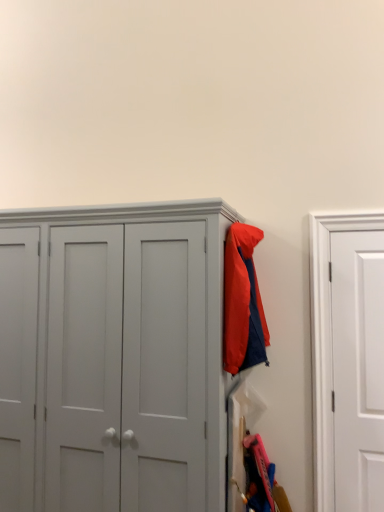
Question: Can you confirm if matte nylon jacket at upper right is taller than white matte door at right?

Choices:
 (A) no
 (B) yes

Answer: (A)

Question: Is matte nylon jacket at upper right oriented towards white matte door at right?

Choices:
 (A) yes
 (B) no

Answer: (B)

Question: Is matte nylon jacket at upper right positioned beyond the bounds of white matte door at right?

Choices:
 (A) no
 (B) yes

Answer: (B)

Question: Is matte nylon jacket at upper right wider than white matte door at right?

Choices:
 (A) no
 (B) yes

Answer: (B)

Question: Is matte nylon jacket at upper right beside white matte door at right?

Choices:
 (A) yes
 (B) no

Answer: (B)

Question: Choose the correct answer: Is matte nylon jacket at upper right inside matte gray cupboard at center or outside it?

Choices:
 (A) outside
 (B) inside

Answer: (A)

Question: Considering the positions of matte nylon jacket at upper right and matte gray cupboard at center in the image, is matte nylon jacket at upper right taller or shorter than matte gray cupboard at center?

Choices:
 (A) tall
 (B) short

Answer: (B)

Question: Based on their positions, is matte nylon jacket at upper right located to the left or right of matte gray cupboard at center?

Choices:
 (A) left
 (B) right

Answer: (B)

Question: Considering their positions, is matte nylon jacket at upper right located in front of or behind matte gray cupboard at center?

Choices:
 (A) behind
 (B) front

Answer: (A)

Question: From a real-world perspective, is white matte door at right positioned above or below matte nylon jacket at upper right?

Choices:
 (A) below
 (B) above

Answer: (A)

Question: In the image, is white matte door at right on the left side or the right side of matte nylon jacket at upper right?

Choices:
 (A) right
 (B) left

Answer: (A)

Question: In terms of height, does white matte door at right look taller or shorter compared to matte nylon jacket at upper right?

Choices:
 (A) tall
 (B) short

Answer: (A)

Question: Choose the correct answer: Is white matte door at right inside matte nylon jacket at upper right or outside it?

Choices:
 (A) inside
 (B) outside

Answer: (B)

Question: Considering the relative positions of matte gray cupboard at center and white matte door at right in the image provided, is matte gray cupboard at center to the left or to the right of white matte door at right?

Choices:
 (A) left
 (B) right

Answer: (A)

Question: Based on their sizes in the image, would you say matte gray cupboard at center is bigger or smaller than white matte door at right?

Choices:
 (A) small
 (B) big

Answer: (B)